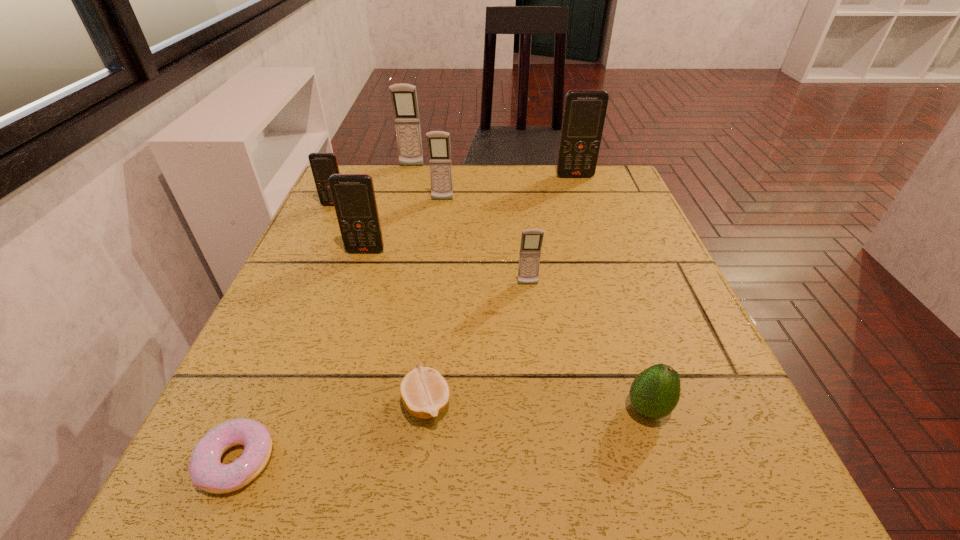
Image resolution: width=960 pixels, height=540 pixels. Identify the location of vacant space that is in between the green avocado and the lemon. (538, 406).

This screenshot has width=960, height=540. Find the location of `unoccupied position between the avocado and the farthest gray cellular telephone`. unoccupied position between the avocado and the farthest gray cellular telephone is located at coordinates (530, 288).

Identify the location of free spot between the farthest cellular telephone and the nearest orange cellular telephone. (389, 209).

Locate an element on the screen. Image resolution: width=960 pixels, height=540 pixels. empty space between the nearest cellular telephone and the avocado is located at coordinates (588, 347).

This screenshot has width=960, height=540. I want to click on unoccupied area between the third farthest cellular telephone and the second orange cellular telephone from left to right, so click(404, 226).

Identify the location of empty space that is in between the third farthest object and the nearest cellular telephone. Image resolution: width=960 pixels, height=540 pixels. (485, 242).

Point out which object is positioned as the fifth nearest to the lemon. Please provide its 2D coordinates. Your answer should be formatted as a tuple, i.e. [(x, y)], where the tuple contains the x and y coordinates of a point satisfying the conditions above.

[(438, 142)]

The image size is (960, 540). I want to click on the eighth closest object to the farthest cellular telephone, so click(x=655, y=392).

In order to click on cellular telephone that is the third closest to the farthest orange cellular telephone in this screenshot , I will do `click(531, 240)`.

Find the location of a particular element. the third closest cellular telephone to the second gray cellular telephone from right to left is located at coordinates (323, 165).